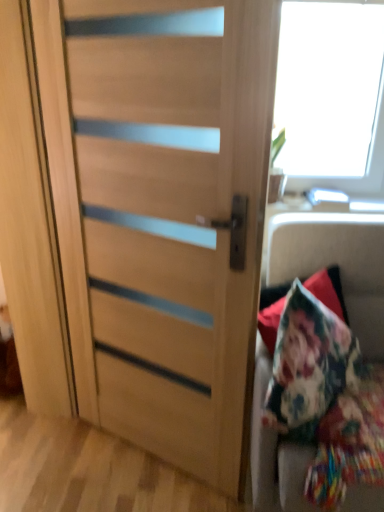
Question: From a real-world perspective, is wooden door at center physically located above or below floral fabric cushion at right?

Choices:
 (A) above
 (B) below

Answer: (A)

Question: Looking at the image, does wooden door at center seem bigger or smaller compared to floral fabric cushion at right?

Choices:
 (A) big
 (B) small

Answer: (B)

Question: Visually, is wooden door at center positioned to the left or to the right of floral fabric cushion at right?

Choices:
 (A) right
 (B) left

Answer: (B)

Question: In terms of size, does floral fabric cushion at right appear bigger or smaller than wooden door at center?

Choices:
 (A) small
 (B) big

Answer: (B)

Question: Is floral fabric cushion at right wider or thinner than wooden door at center?

Choices:
 (A) thin
 (B) wide

Answer: (B)

Question: Choose the correct answer: Is floral fabric cushion at right inside wooden door at center or outside it?

Choices:
 (A) inside
 (B) outside

Answer: (B)

Question: Considering their positions, is floral fabric cushion at right located in front of or behind wooden door at center?

Choices:
 (A) behind
 (B) front

Answer: (A)